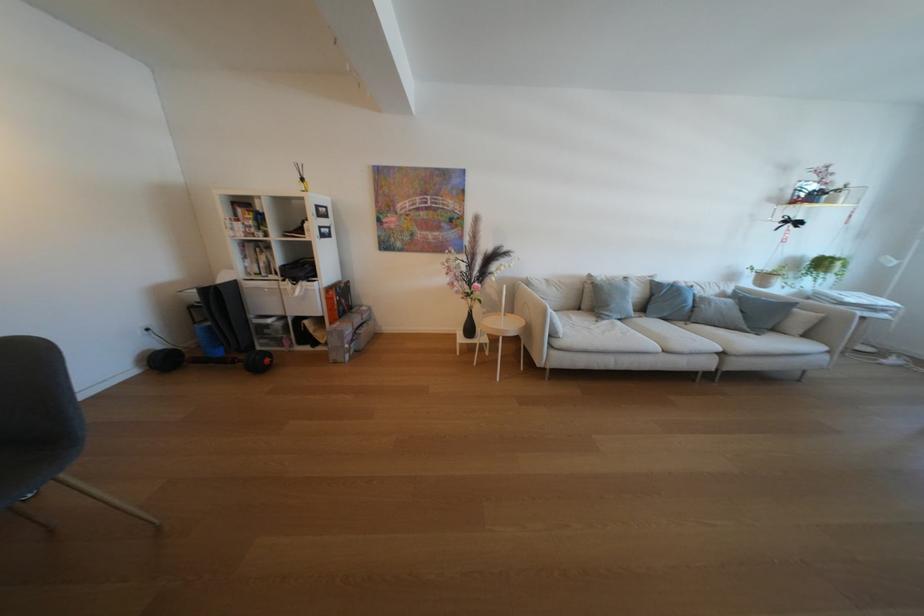
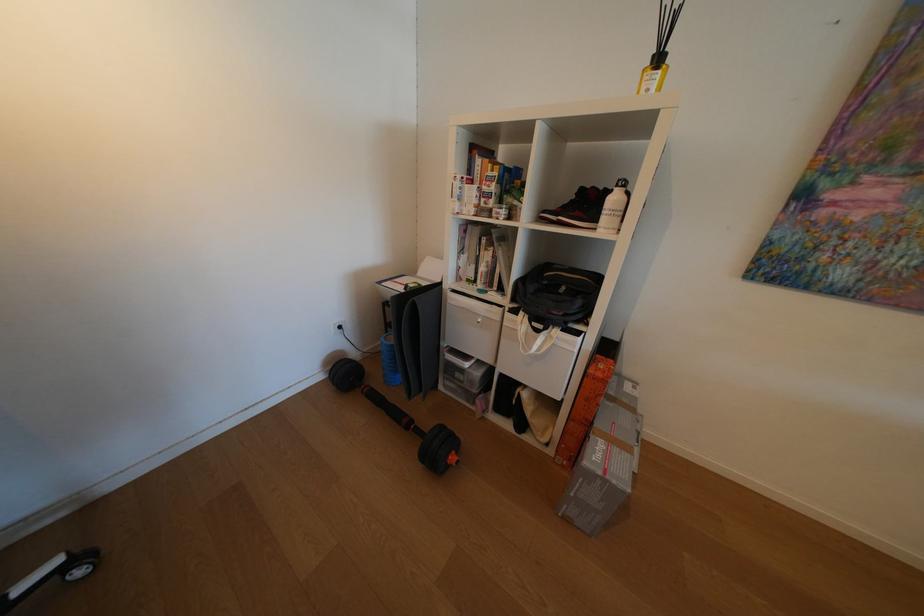
Question: I am providing you with two images of the same scene from different viewpoints. Which of the following objects are not visible in image2?

Choices:
 (A) black folded mat
 (B) yellow diffuser bottle
 (C) grey cardboard box
 (D) none of these

Answer: (D)